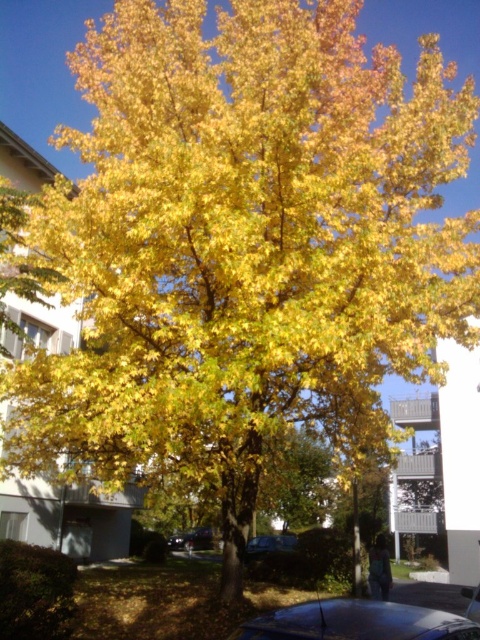
At what (x,y) coordinates should I click in order to perform the action: click on metallic blue car at center. Please return your answer as a coordinate pair (x, y). The height and width of the screenshot is (640, 480). Looking at the image, I should click on (269, 547).

Between point (282, 541) and point (204, 532), which one is positioned behind?

Positioned behind is point (204, 532).

Locate an element on the screen. The width and height of the screenshot is (480, 640). metallic blue car at center is located at coordinates (269, 547).

Describe the element at coordinates (357, 621) in the screenshot. I see `glossy metallic car at lower center` at that location.

Is point (304, 609) positioned after point (261, 544)?

No, it is in front of (261, 544).

At what (x,y) coordinates should I click in order to perform the action: click on glossy metallic car at lower center. Please return your answer as a coordinate pair (x, y). This screenshot has width=480, height=640. Looking at the image, I should click on (357, 621).

Does glossy metallic car at lower center have a smaller size compared to shiny black car at center?

Incorrect, glossy metallic car at lower center is not smaller in size than shiny black car at center.

Does glossy metallic car at lower center have a greater height compared to shiny black car at center?

Correct, glossy metallic car at lower center is much taller as shiny black car at center.

Between point (300, 605) and point (196, 545), which one is positioned in front?

Point (300, 605) is more forward.

Where is `glossy metallic car at lower center`? The height and width of the screenshot is (640, 480). glossy metallic car at lower center is located at coordinates (357, 621).